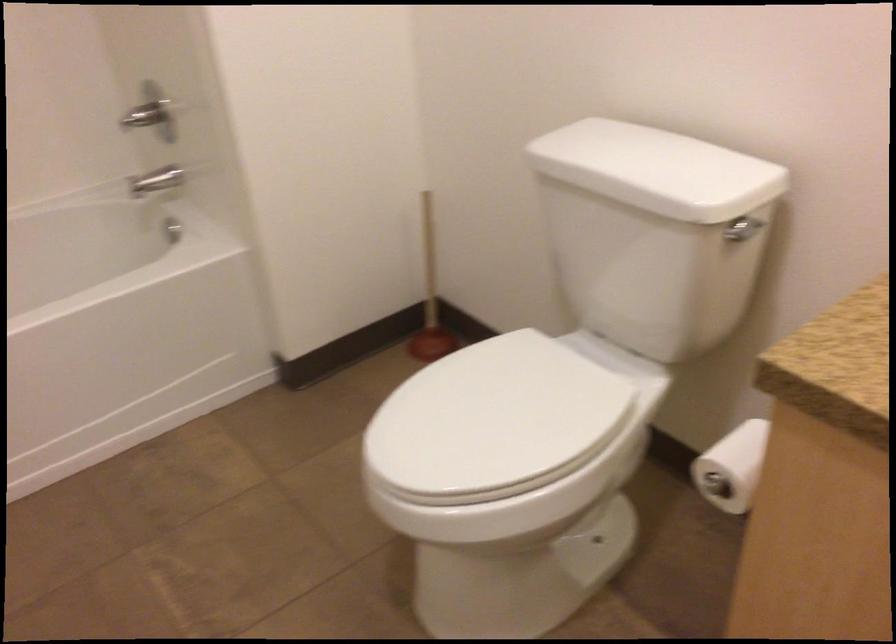
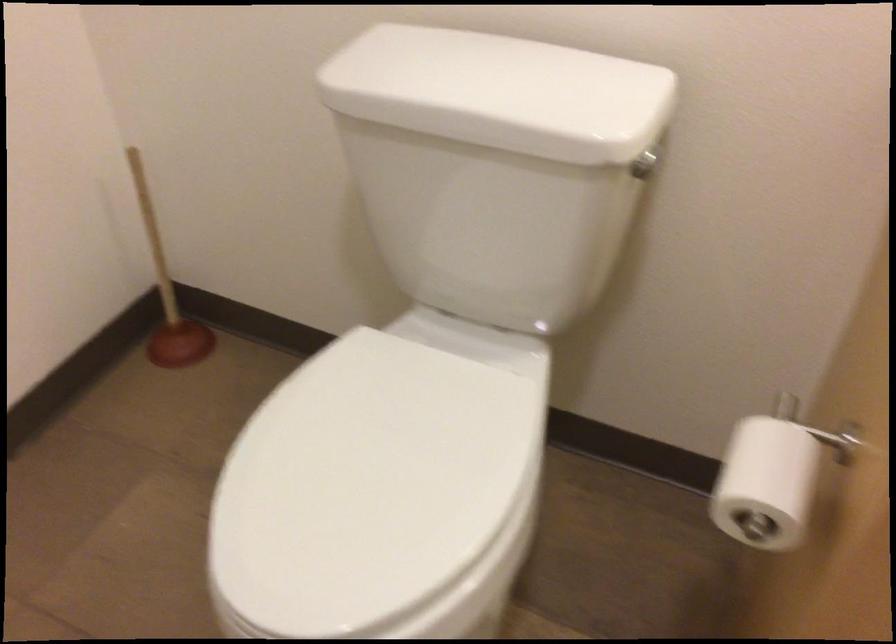
The point at (x=425, y=296) is marked in the first image. Where is the corresponding point in the second image?

(167, 292)